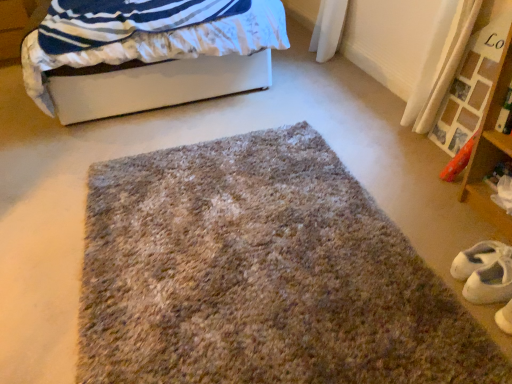
Find the location of a particular element. Image resolution: width=512 pixels, height=384 pixels. vacant area that lies between fuzzy carpet at center and white suede shoe at lower right is located at coordinates (401, 211).